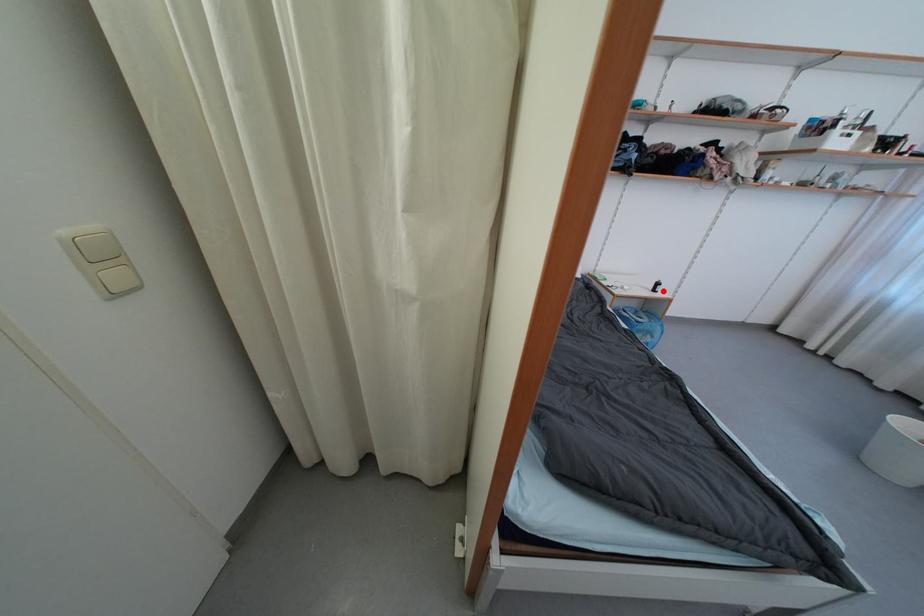
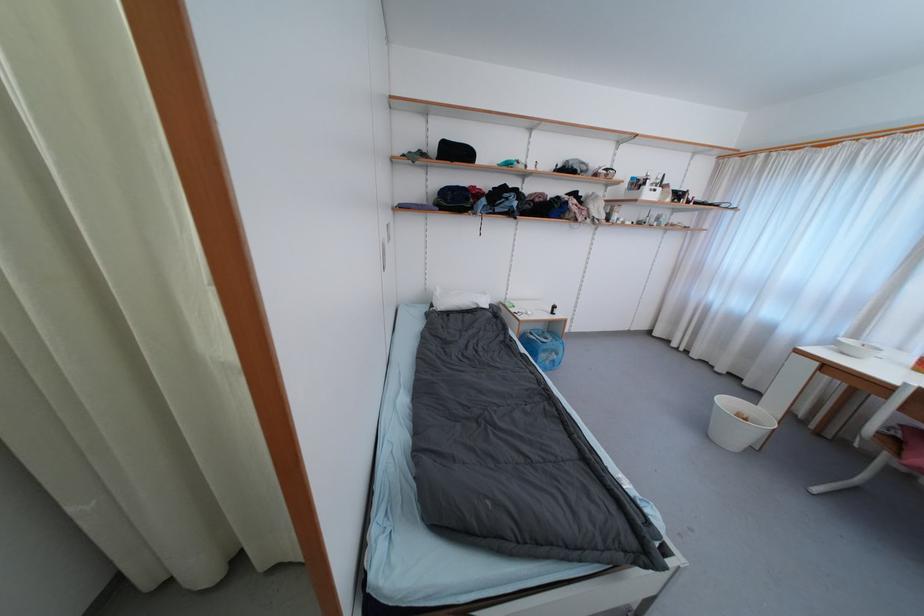
Find the pixel in the second image that matches the highlighted location in the first image.

(560, 313)